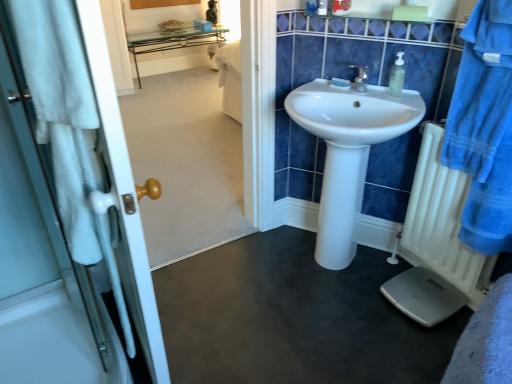
Where is `free spot to the left of white glossy sink at center`? free spot to the left of white glossy sink at center is located at coordinates (246, 278).